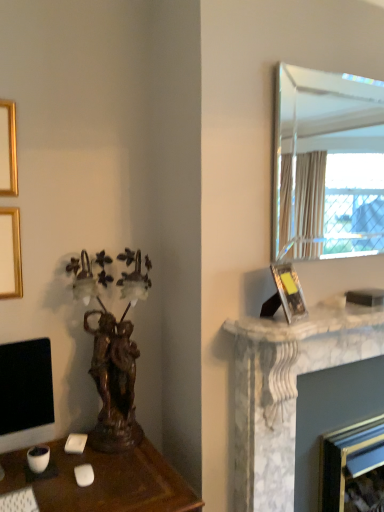
Question: Is white marble fireplace at right surrounded by white plastic keyboard at lower left?

Choices:
 (A) no
 (B) yes

Answer: (A)

Question: Considering the relative positions of white plastic keyboard at lower left and white marble fireplace at right in the image provided, is white plastic keyboard at lower left behind white marble fireplace at right?

Choices:
 (A) no
 (B) yes

Answer: (A)

Question: Considering the relative sizes of white plastic keyboard at lower left and white marble fireplace at right in the image provided, is white plastic keyboard at lower left shorter than white marble fireplace at right?

Choices:
 (A) no
 (B) yes

Answer: (A)

Question: Is white plastic keyboard at lower left not within white marble fireplace at right?

Choices:
 (A) no
 (B) yes

Answer: (B)

Question: Considering the relative sizes of white plastic keyboard at lower left and white marble fireplace at right in the image provided, is white plastic keyboard at lower left thinner than white marble fireplace at right?

Choices:
 (A) no
 (B) yes

Answer: (B)

Question: Considering their positions, is clear glass mirror at upper right located in front of or behind matte black monitor at lower left?

Choices:
 (A) behind
 (B) front

Answer: (A)

Question: From a real-world perspective, is clear glass mirror at upper right physically located above or below matte black monitor at lower left?

Choices:
 (A) below
 (B) above

Answer: (B)

Question: Is clear glass mirror at upper right wider or thinner than matte black monitor at lower left?

Choices:
 (A) thin
 (B) wide

Answer: (A)

Question: Is point (296, 193) positioned closer to the camera than point (41, 382)?

Choices:
 (A) farther
 (B) closer

Answer: (A)

Question: Based on their sizes in the image, would you say white marble fireplace at right, marked as the 2th fireplace in a top-to-bottom arrangement, is bigger or smaller than white plastic keyboard at lower left?

Choices:
 (A) small
 (B) big

Answer: (B)

Question: Is point (319, 478) positioned closer to the camera than point (31, 510)?

Choices:
 (A) farther
 (B) closer

Answer: (A)

Question: From a real-world perspective, is white marble fireplace at right, marked as the 2th fireplace in a top-to-bottom arrangement, physically located above or below white plastic keyboard at lower left?

Choices:
 (A) above
 (B) below

Answer: (B)

Question: Considering the positions of white marble fireplace at right, marked as the 2th fireplace in a top-to-bottom arrangement, and white plastic keyboard at lower left in the image, is white marble fireplace at right, marked as the 2th fireplace in a top-to-bottom arrangement, wider or thinner than white plastic keyboard at lower left?

Choices:
 (A) thin
 (B) wide

Answer: (B)

Question: Visually, is white marble fireplace at right positioned to the left or to the right of white plastic keyboard at lower left?

Choices:
 (A) left
 (B) right

Answer: (B)

Question: Considering the positions of white marble fireplace at right and white plastic keyboard at lower left in the image, is white marble fireplace at right taller or shorter than white plastic keyboard at lower left?

Choices:
 (A) tall
 (B) short

Answer: (B)